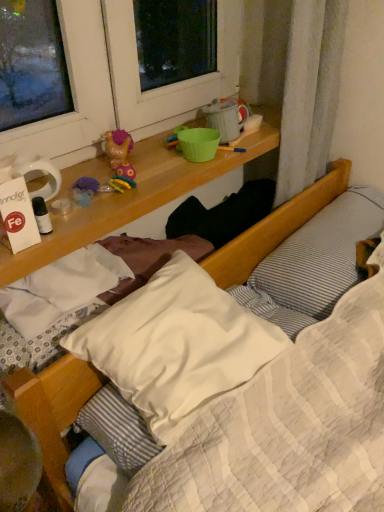
Question: Looking at their shapes, would you say gold plastic toy at upper center is wider or thinner than white soft pillow at center, the first pillow from the left?

Choices:
 (A) thin
 (B) wide

Answer: (A)

Question: Choose the correct answer: Is gold plastic toy at upper center inside white soft pillow at center, the first pillow from the left, or outside it?

Choices:
 (A) inside
 (B) outside

Answer: (B)

Question: Based on their relative distances, which object is farther from the gold plastic toy at upper center?

Choices:
 (A) white soft pillow at center, the 2th pillow positioned from the right
 (B) white striped pillow at upper right, the 2th pillow when ordered from left to right

Answer: (B)

Question: Based on their relative distances, which object is nearer to the white striped pillow at upper right, acting as the first pillow starting from the right?

Choices:
 (A) gold plastic toy at upper center
 (B) white soft pillow at center, the 2th pillow positioned from the right

Answer: (B)